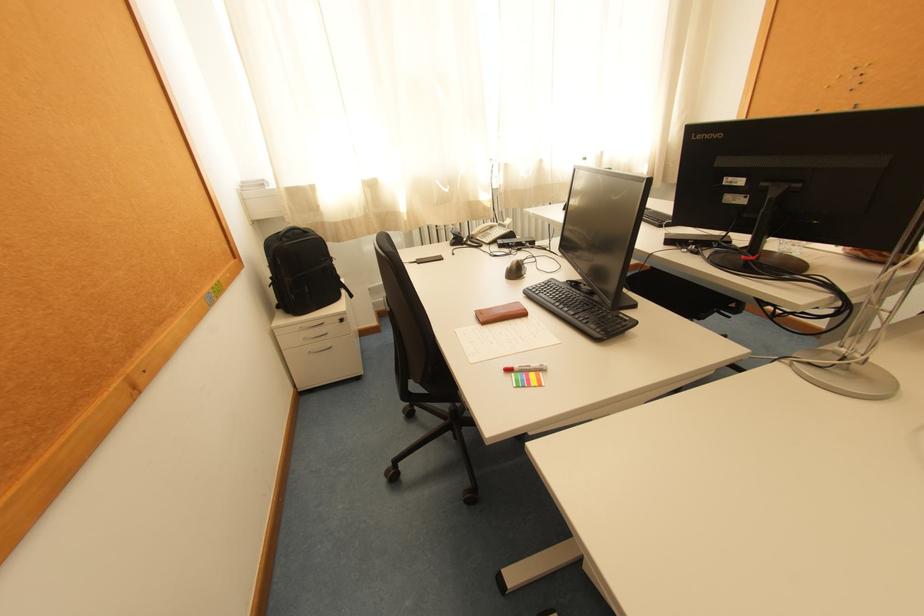
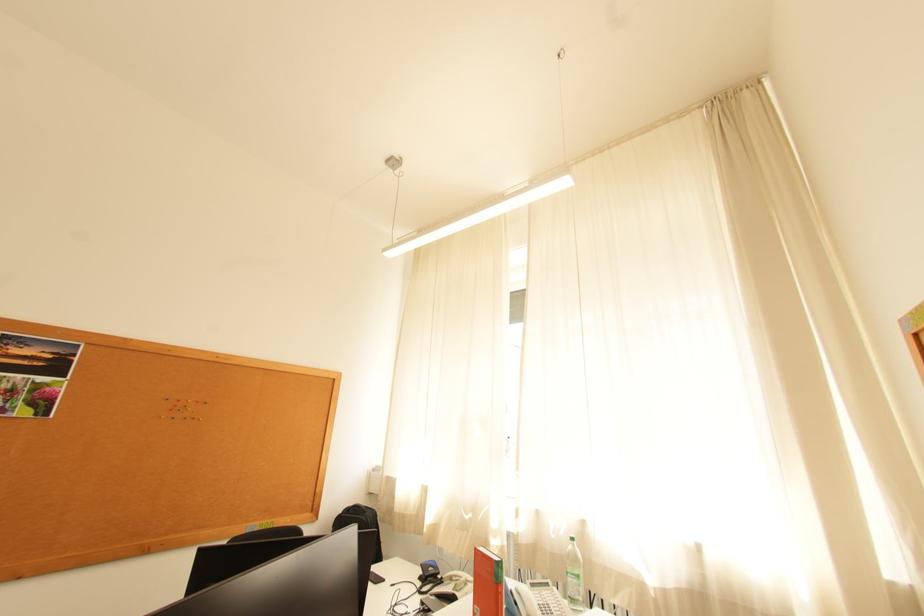
Find the pixel in the second image that matches (539,176) in the first image.

(569, 536)